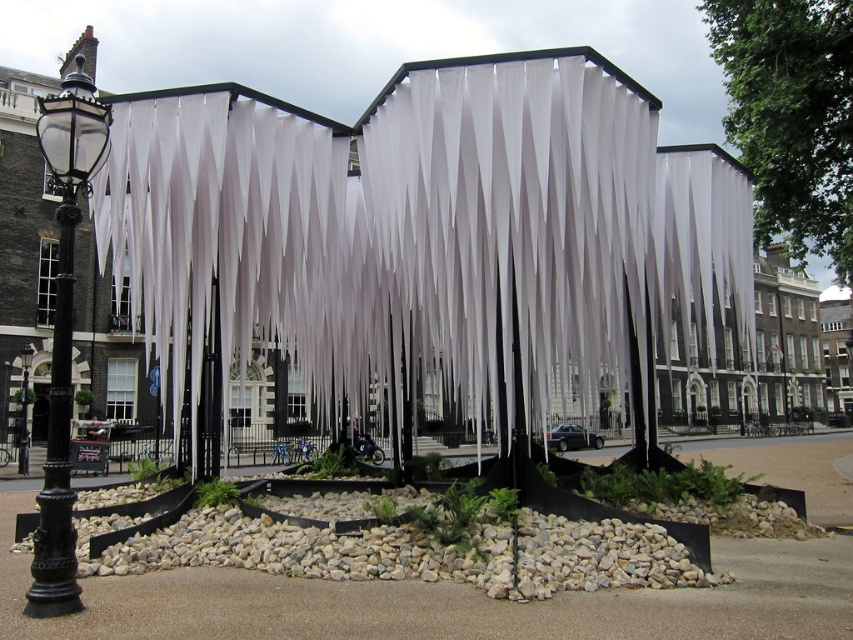
Does white fabric curtain at center have a lesser width compared to black glass lamp post at left?

Incorrect, white fabric curtain at center's width is not less than black glass lamp post at left's.

Is white fabric curtain at center taller than black glass lamp post at left?

No.

Between point (503, 257) and point (49, 170), which one is positioned behind?

The point (49, 170) is more distant.

Find the location of a particular element. Image resolution: width=853 pixels, height=640 pixels. white fabric curtain at center is located at coordinates (418, 220).